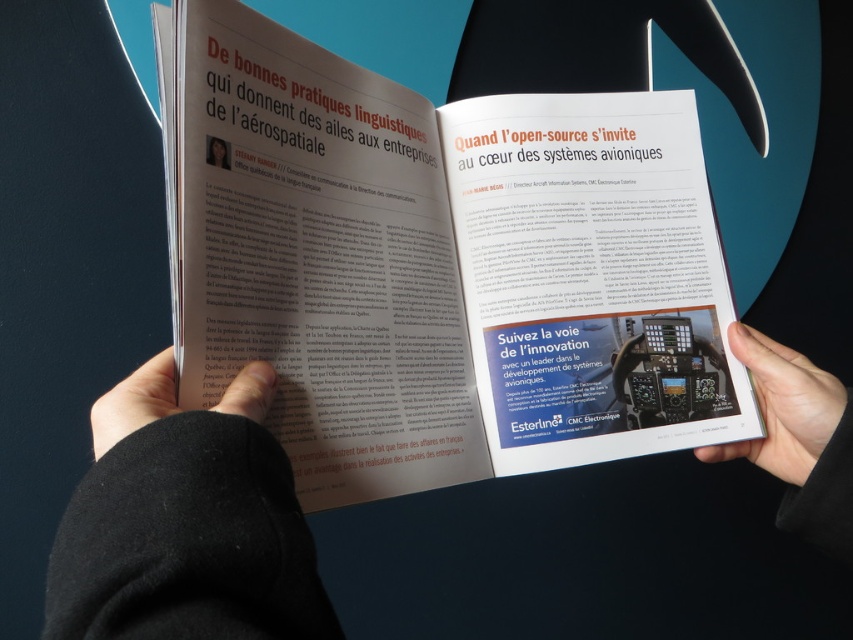
Question: Does black fabric hand at upper center have a larger size compared to black matte hand at lower left?

Choices:
 (A) yes
 (B) no

Answer: (A)

Question: Estimate the real-world distances between objects in this image. Which object is farther from the black matte hand at lower left?

Choices:
 (A) white paper magazine at center
 (B) black fabric hand at upper center
 (C) black matte hand at lower right

Answer: (C)

Question: Which object appears closest to the camera in this image?

Choices:
 (A) black fabric hand at upper center
 (B) black matte hand at lower left
 (C) black matte hand at lower right
 (D) white paper magazine at center

Answer: (A)

Question: Can you confirm if white paper magazine at center is positioned below black matte hand at lower left?

Choices:
 (A) yes
 (B) no

Answer: (B)

Question: Which point is closer to the camera taking this photo?

Choices:
 (A) (790, 400)
 (B) (109, 428)
 (C) (345, 225)

Answer: (B)

Question: Is white paper magazine at center wider than black matte hand at lower left?

Choices:
 (A) no
 (B) yes

Answer: (B)